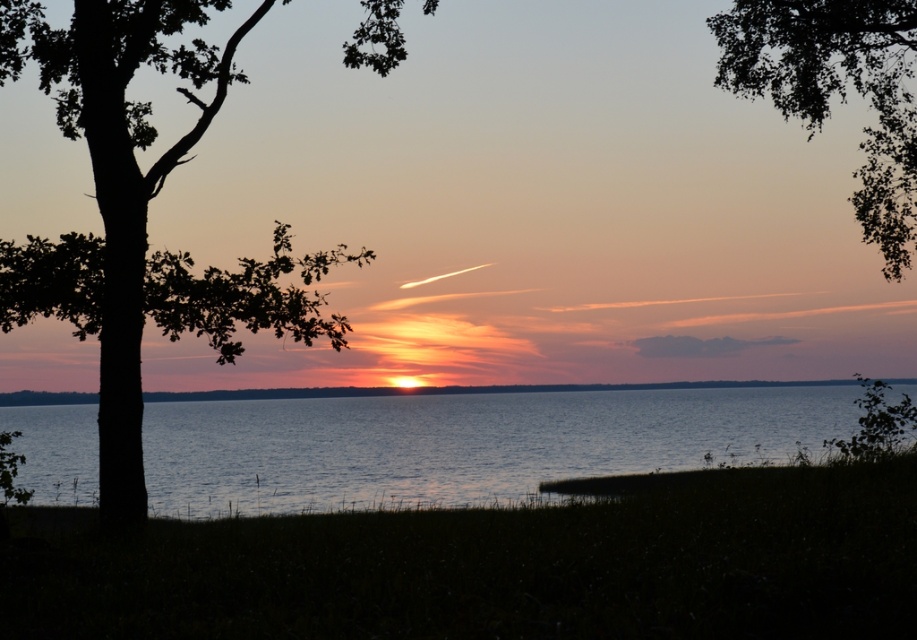
Looking at this image, you are standing at the point with coordinates point (x=158, y=257) and want to walk towards the point with coordinates point (x=319, y=396). Will you have to go through any obstacles along the way?

Answer: Point (x=158, y=257) is in front of point (x=319, y=396), so you will have to walk towards the point (x=319, y=396) through the area where point (x=158, y=257) is located. However, since the scene description mentions a silhouette of a tree on the left side but does not mention any obstacles between the two points, there are no obstacles blocking the path between them.

You are a photographer standing at the center of the scene. You want to take a photo that includes both the point at (326, 420) and the point at (877, 12). Based on their positions, which point is closer to the camera?

Point (877, 12) is closer to the camera because it is in front of point (326, 420).